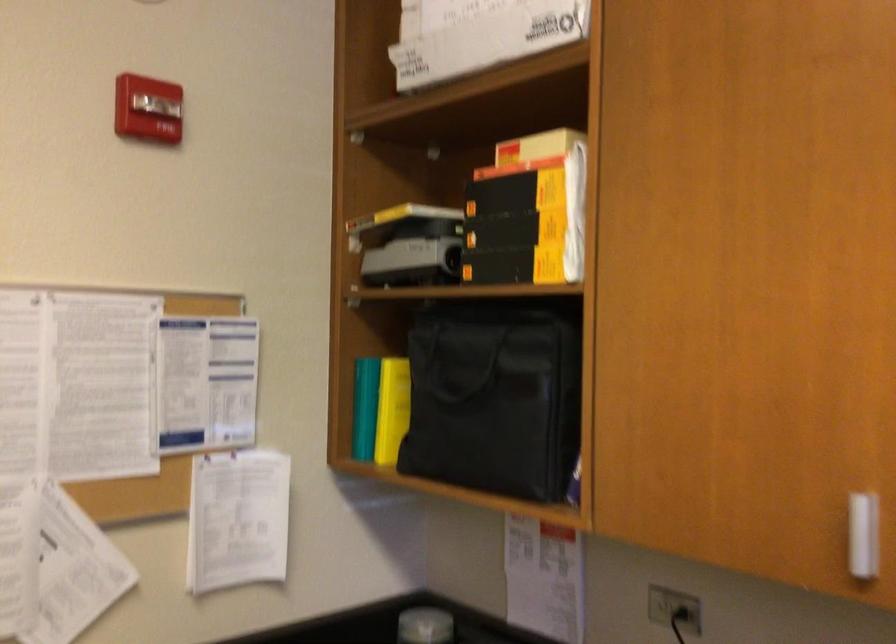
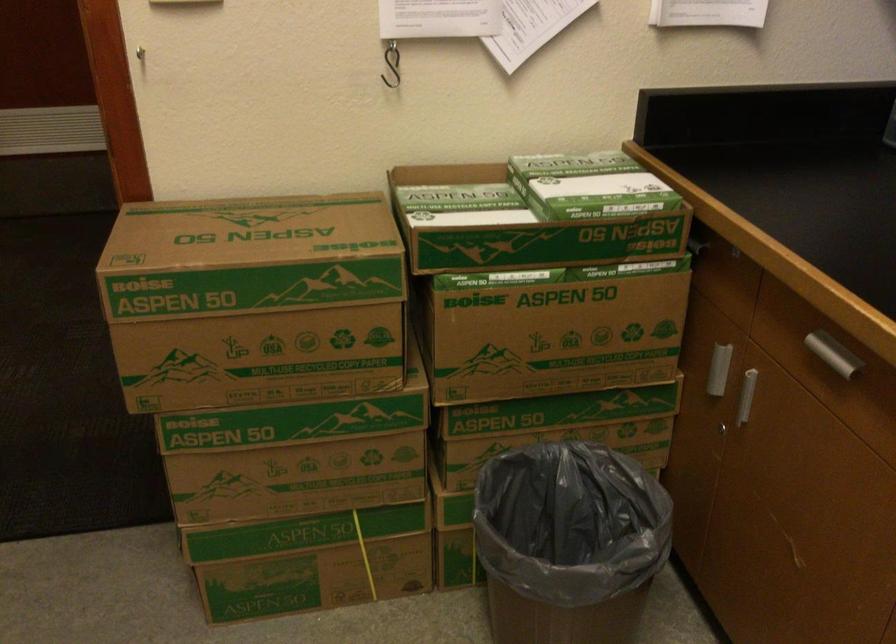
Find the pixel in the second image that matches [239,574] in the first image.

(708, 13)